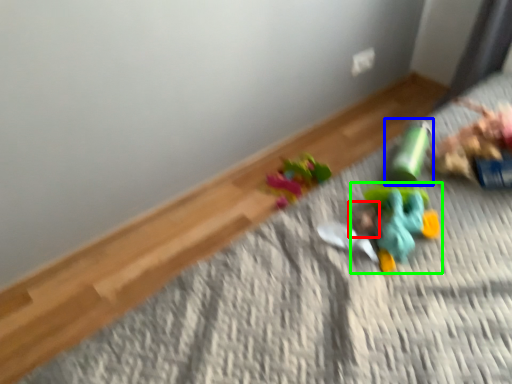
Question: Which object is positioned farthest from head (highlighted by a red box)? Select from toy (highlighted by a blue box) and toy (highlighted by a green box).

Choices:
 (A) toy
 (B) toy

Answer: (A)